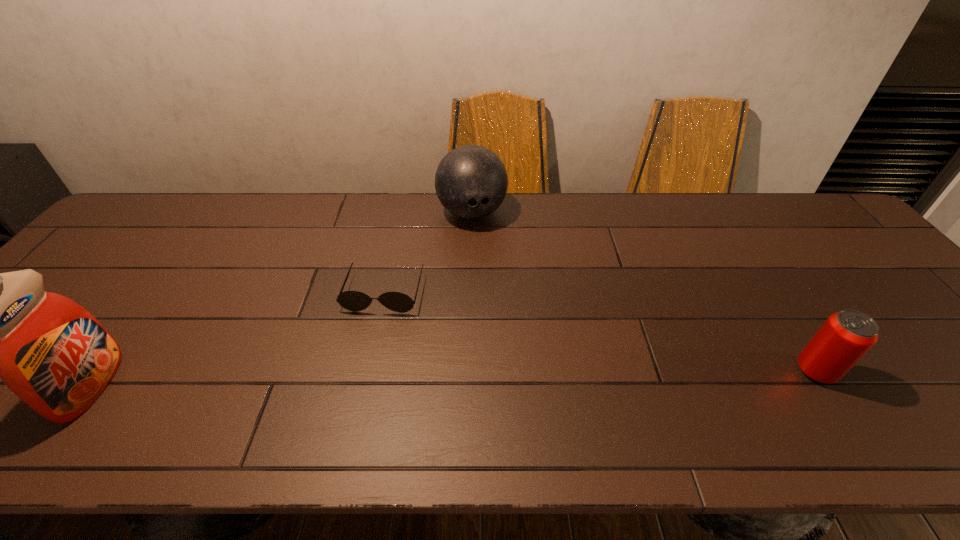
Image resolution: width=960 pixels, height=540 pixels. I want to click on free space located 0.100m on the front-facing side of the third object from right to left, so click(367, 347).

The height and width of the screenshot is (540, 960). In order to click on free space located 0.210m on the front-facing side of the third object from right to left in this screenshot , I will do `click(354, 388)`.

You are a GUI agent. You are given a task and a screenshot of the screen. Output one action in this format:
    pyautogui.click(x=<x>, y=<y>)
    Task: Click on the free spot located 0.140m on the front-facing side of the third object from right to left
    Image resolution: width=960 pixels, height=540 pixels.
    Given the screenshot: What is the action you would take?
    pyautogui.click(x=363, y=361)

Where is `vacant space located 0.210m on the grip area of the farthest object`? Image resolution: width=960 pixels, height=540 pixels. vacant space located 0.210m on the grip area of the farthest object is located at coordinates (496, 281).

Locate an element on the screen. vacant region located 0.360m on the grip area of the farthest object is located at coordinates (512, 324).

Locate an element on the screen. vacant space located on the grip area of the farthest object is located at coordinates (492, 267).

Where is `object present at the far edge`? The image size is (960, 540). object present at the far edge is located at coordinates (471, 181).

At what (x,y) coordinates should I click in order to perform the action: click on detergent present at the near edge. Please return your answer as a coordinate pair (x, y). The width and height of the screenshot is (960, 540). Looking at the image, I should click on (52, 353).

Locate an element on the screen. This screenshot has width=960, height=540. can that is at the near edge is located at coordinates (846, 336).

What are the coordinates of `free space at the far edge of the desktop` in the screenshot? It's located at (655, 225).